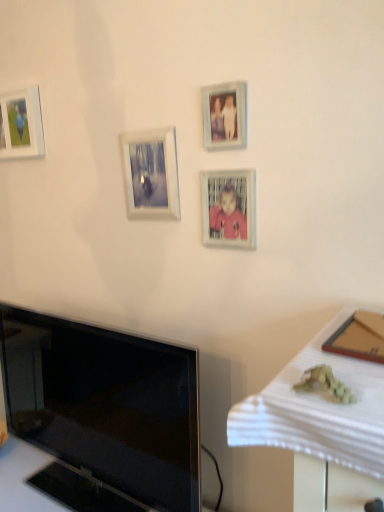
Question: Considering the positions of matte plastic picture frame at center, the first picture frame from the right, and light blue wooden picture frame at upper center, marked as the fourth picture frame in a back-to-front arrangement, in the image, is matte plastic picture frame at center, the first picture frame from the right, taller or shorter than light blue wooden picture frame at upper center, marked as the fourth picture frame in a back-to-front arrangement,?

Choices:
 (A) short
 (B) tall

Answer: (B)

Question: In the image, is matte plastic picture frame at center, which is counted as the third picture frame, starting from the back, on the left side or the right side of light blue wooden picture frame at upper center, the first picture frame in the front-to-back sequence?

Choices:
 (A) left
 (B) right

Answer: (B)

Question: Estimate the real-world distances between objects in this image. Which object is closer to the matte glass photo frame at upper center, the 3th picture frame in the right-to-left sequence?

Choices:
 (A) light blue wooden picture frame at upper center, the first picture frame in the front-to-back sequence
 (B) matte plastic picture frame at center, the first picture frame from the right
 (C) matte white picture frame at upper left, the 1th picture frame viewed from the back
 (D) black glossy tv at lower left

Answer: (B)

Question: Which of these objects is positioned closest to the matte white picture frame at upper left, acting as the 4th picture frame starting from the front?

Choices:
 (A) matte glass photo frame at upper center, marked as the 2th picture frame in a back-to-front arrangement
 (B) black glossy tv at lower left
 (C) light blue wooden picture frame at upper center, marked as the fourth picture frame in a back-to-front arrangement
 (D) matte plastic picture frame at center, which is counted as the third picture frame, starting from the back

Answer: (A)